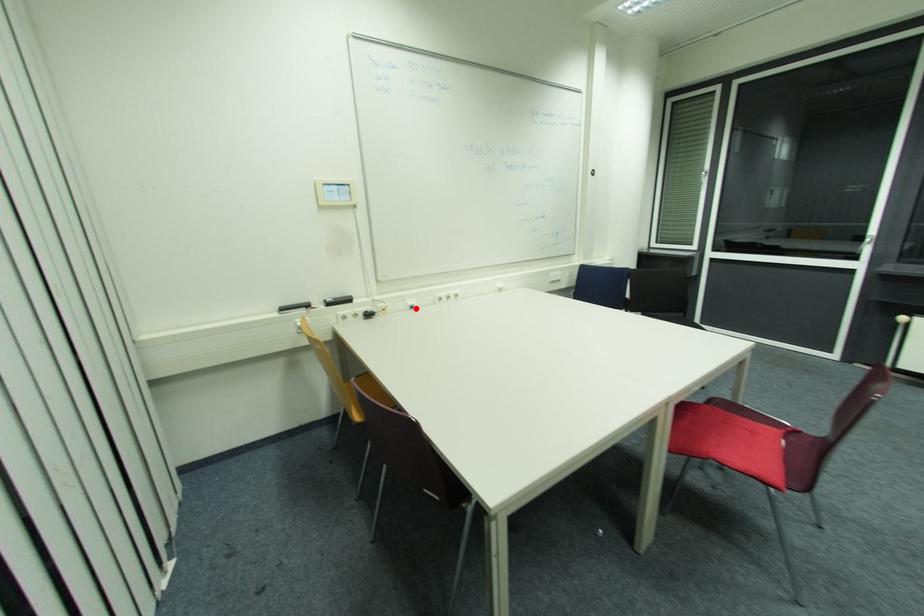
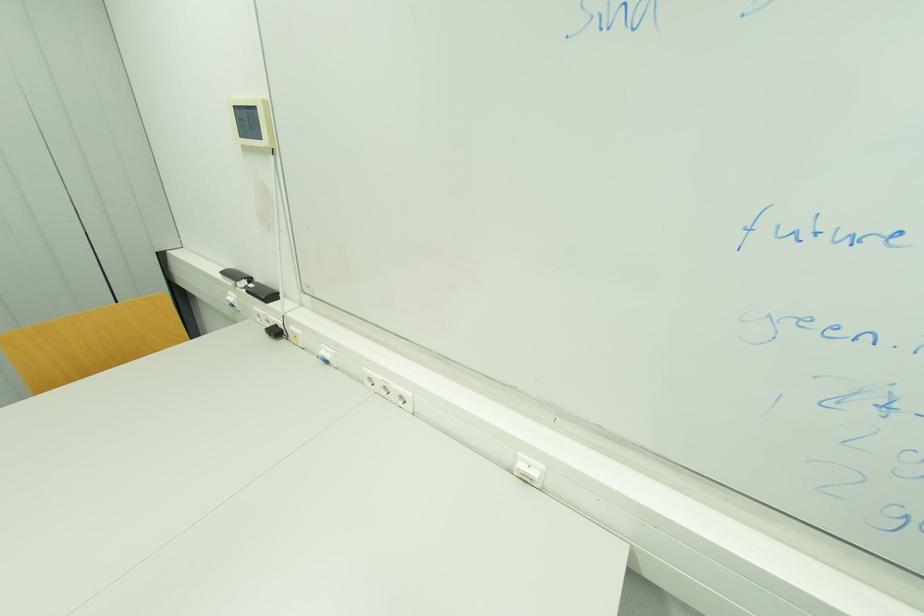
Find the pixel in the second image that matches the highlighted location in the first image.

(330, 362)